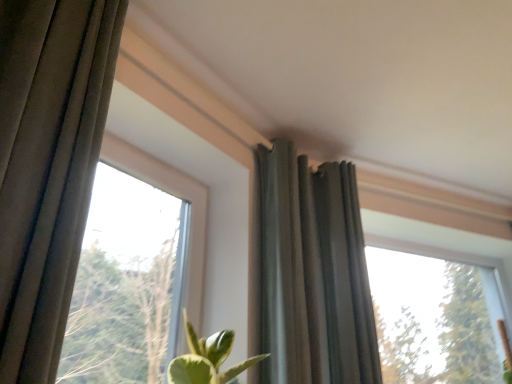
You are a GUI agent. You are given a task and a screenshot of the screen. Output one action in this format:
    pyautogui.click(x=<x>, y=<y>)
    Task: Click on the transparent glass window at upper right, arranged as the 2th window when viewed from the front
    The width and height of the screenshot is (512, 384).
    Given the screenshot: What is the action you would take?
    pyautogui.click(x=436, y=314)

Where is `dark gray fabric curtain at upper center`? The height and width of the screenshot is (384, 512). dark gray fabric curtain at upper center is located at coordinates (313, 273).

Where is `transparent glass window at upper left, arranged as the second window when viewed from the right`? Image resolution: width=512 pixels, height=384 pixels. transparent glass window at upper left, arranged as the second window when viewed from the right is located at coordinates (134, 271).

Between transparent glass window at upper right, the 1th window positioned from the back, and dark gray fabric curtain at upper center, which one appears on the left side from the viewer's perspective?

From the viewer's perspective, dark gray fabric curtain at upper center appears more on the left side.

Does transparent glass window at upper right, the 2th window in the left-to-right sequence, contain dark gray fabric curtain at upper center?

That's incorrect, dark gray fabric curtain at upper center is not inside transparent glass window at upper right, the 2th window in the left-to-right sequence.

Is transparent glass window at upper right, the 2th window in the left-to-right sequence, aimed at dark gray fabric curtain at upper center?

No, transparent glass window at upper right, the 2th window in the left-to-right sequence, is not facing towards dark gray fabric curtain at upper center.

Is transparent glass window at upper right, arranged as the 2th window when viewed from the front, directly adjacent to dark gray fabric curtain at upper center?

No, transparent glass window at upper right, arranged as the 2th window when viewed from the front, is not in contact with dark gray fabric curtain at upper center.

From a real-world perspective, is transparent glass window at upper right, the 2th window in the left-to-right sequence, located higher than transparent glass window at upper left, which appears as the 2th window when viewed from the back?

Indeed, from a real-world perspective, transparent glass window at upper right, the 2th window in the left-to-right sequence, stands above transparent glass window at upper left, which appears as the 2th window when viewed from the back.

Where is `window behind the transparent glass window at upper left, arranged as the second window when viewed from the right`? This screenshot has width=512, height=384. window behind the transparent glass window at upper left, arranged as the second window when viewed from the right is located at coordinates (436, 314).

Consider the image. From the image's perspective, does transparent glass window at upper right, the 1th window positioned from the back, appear lower than transparent glass window at upper left, which appears as the 2th window when viewed from the back?

Yes, from the image's perspective, transparent glass window at upper right, the 1th window positioned from the back, is below transparent glass window at upper left, which appears as the 2th window when viewed from the back.

Between transparent glass window at upper right, the 2th window in the left-to-right sequence, and transparent glass window at upper left, which is the first window from left to right, which one has smaller size?

transparent glass window at upper left, which is the first window from left to right, is smaller.

The image size is (512, 384). What are the coordinates of `window in front of the dark gray fabric curtain at upper center` in the screenshot? It's located at (134, 271).

Is transparent glass window at upper left, arranged as the second window when viewed from the right, far away from dark gray fabric curtain at upper center?

No, there isn't a large distance between transparent glass window at upper left, arranged as the second window when viewed from the right, and dark gray fabric curtain at upper center.

Does transparent glass window at upper left, arranged as the second window when viewed from the right, appear on the right side of dark gray fabric curtain at upper center?

No.

Which object is further away from the camera taking this photo, transparent glass window at upper left, which is the first window from left to right, or dark gray fabric curtain at upper center?

dark gray fabric curtain at upper center is behind.

Is point (291, 319) farther from viewer compared to point (404, 327)?

No.

Are dark gray fabric curtain at upper center and transparent glass window at upper right, the 1th window positioned from the back, located far from each other?

Yes, dark gray fabric curtain at upper center and transparent glass window at upper right, the 1th window positioned from the back, are quite far apart.

Which object is further away from the camera, dark gray fabric curtain at upper center or transparent glass window at upper right, arranged as the 2th window when viewed from the front?

transparent glass window at upper right, arranged as the 2th window when viewed from the front, is further away from the camera.

From a real-world perspective, is dark gray fabric curtain at upper center above or below transparent glass window at upper right, the 1th window positioned from the back?

From a real-world perspective, dark gray fabric curtain at upper center is physically above transparent glass window at upper right, the 1th window positioned from the back.

Consider the image. Can you confirm if dark gray fabric curtain at upper center is positioned to the right of transparent glass window at upper left, arranged as the second window when viewed from the right?

Indeed, dark gray fabric curtain at upper center is positioned on the right side of transparent glass window at upper left, arranged as the second window when viewed from the right.

This screenshot has height=384, width=512. Find the location of `window to the left of dark gray fabric curtain at upper center`. window to the left of dark gray fabric curtain at upper center is located at coordinates (134, 271).

Does dark gray fabric curtain at upper center contain transparent glass window at upper left, arranged as the second window when viewed from the right?

Definitely not — transparent glass window at upper left, arranged as the second window when viewed from the right, is not inside dark gray fabric curtain at upper center.

Based on the photo, in the image, is dark gray fabric curtain at upper center positioned in front of or behind transparent glass window at upper left, which is the first window from left to right?

dark gray fabric curtain at upper center is behind transparent glass window at upper left, which is the first window from left to right.

Is point (197, 280) closer to viewer compared to point (421, 249)?

That is True.

Are transparent glass window at upper left, arranged as the second window when viewed from the right, and transparent glass window at upper right, marked as the 1th window in a right-to-left arrangement, beside each other?

No, transparent glass window at upper left, arranged as the second window when viewed from the right, is not touching transparent glass window at upper right, marked as the 1th window in a right-to-left arrangement.

Is transparent glass window at upper left, which appears as the 2th window when viewed from the back, closer to camera compared to transparent glass window at upper right, arranged as the 2th window when viewed from the front?

Yes, transparent glass window at upper left, which appears as the 2th window when viewed from the back, is in front of transparent glass window at upper right, arranged as the 2th window when viewed from the front.

In the scene shown: Is transparent glass window at upper left, which is the first window from left to right, oriented away from transparent glass window at upper right, arranged as the 2th window when viewed from the front?

No, transparent glass window at upper left, which is the first window from left to right,'s orientation is not away from transparent glass window at upper right, arranged as the 2th window when viewed from the front.

Locate an element on the screen. window behind the dark gray fabric curtain at upper center is located at coordinates (436, 314).

Where is `window that appears below the transparent glass window at upper right, marked as the 1th window in a right-to-left arrangement (from a real-world perspective)`? The height and width of the screenshot is (384, 512). window that appears below the transparent glass window at upper right, marked as the 1th window in a right-to-left arrangement (from a real-world perspective) is located at coordinates (134, 271).

When comparing their distances from transparent glass window at upper left, which appears as the 2th window when viewed from the back, does transparent glass window at upper right, the 1th window positioned from the back, or dark gray fabric curtain at upper center seem further?

Based on the image, transparent glass window at upper right, the 1th window positioned from the back, appears to be further to transparent glass window at upper left, which appears as the 2th window when viewed from the back.

Looking at the image, which one is located further to dark gray fabric curtain at upper center, transparent glass window at upper left, which appears as the 2th window when viewed from the back, or transparent glass window at upper right, the 1th window positioned from the back?

transparent glass window at upper right, the 1th window positioned from the back, is positioned further to the anchor dark gray fabric curtain at upper center.

From the image, which object appears to be nearer to transparent glass window at upper right, the 2th window in the left-to-right sequence, dark gray fabric curtain at upper center or transparent glass window at upper left, the first window viewed from the front?

dark gray fabric curtain at upper center.

In the scene shown: Which object lies further to the anchor point dark gray fabric curtain at upper center, transparent glass window at upper right, arranged as the 2th window when viewed from the front, or transparent glass window at upper left, the first window viewed from the front?

The object further to dark gray fabric curtain at upper center is transparent glass window at upper right, arranged as the 2th window when viewed from the front.

Estimate the real-world distances between objects in this image. Which object is closer to transparent glass window at upper right, the 1th window positioned from the back, transparent glass window at upper left, which is the first window from left to right, or dark gray fabric curtain at upper center?

dark gray fabric curtain at upper center is closer to transparent glass window at upper right, the 1th window positioned from the back.

Estimate the real-world distances between objects in this image. Which object is closer to transparent glass window at upper left, the first window viewed from the front, dark gray fabric curtain at upper center or transparent glass window at upper right, arranged as the 2th window when viewed from the front?

dark gray fabric curtain at upper center is closer to transparent glass window at upper left, the first window viewed from the front.

The height and width of the screenshot is (384, 512). In order to click on curtain located between transparent glass window at upper left, which is the first window from left to right, and transparent glass window at upper right, marked as the 1th window in a right-to-left arrangement, in the left-right direction in this screenshot , I will do `click(313, 273)`.